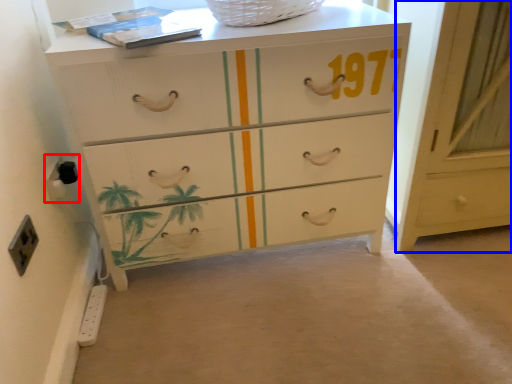
Question: Among these objects, which one is farthest to the camera, electric outlet (highlighted by a red box) or cabinetry (highlighted by a blue box)?

Choices:
 (A) electric outlet
 (B) cabinetry

Answer: (A)